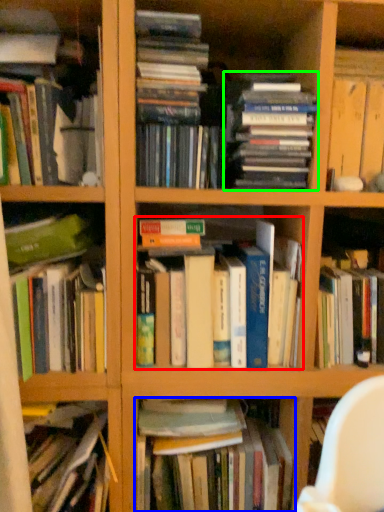
Question: Which object is positioned closest to book (highlighted by a red box)? Select from book (highlighted by a blue box) and book (highlighted by a green box).

Choices:
 (A) book
 (B) book

Answer: (B)